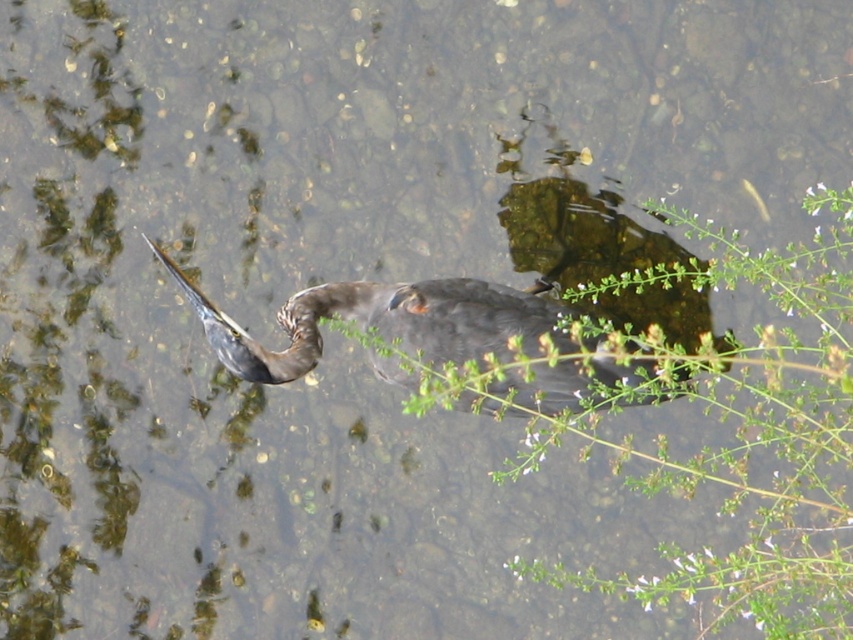
Question: Does green leafy plant at center have a smaller size compared to dark brown feathers at center?

Choices:
 (A) no
 (B) yes

Answer: (A)

Question: Does green leafy plant at center come behind dark brown feathers at center?

Choices:
 (A) yes
 (B) no

Answer: (B)

Question: Which of the following is the farthest from the observer?

Choices:
 (A) (795, 358)
 (B) (241, 336)

Answer: (A)

Question: Which object is closer to the camera taking this photo?

Choices:
 (A) green leafy plant at center
 (B) dark brown feathers at center

Answer: (A)

Question: Observing the image, what is the correct spatial positioning of green leafy plant at center in reference to dark brown feathers at center?

Choices:
 (A) right
 (B) left

Answer: (A)